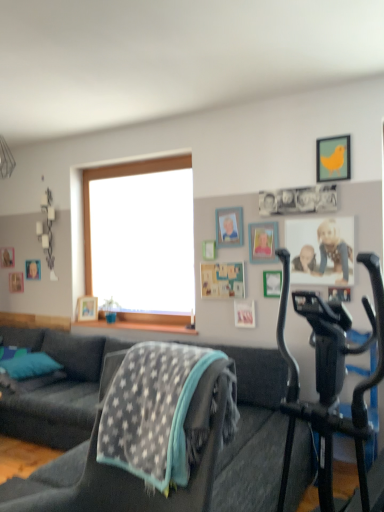
Question: Would you say wooden picture frame at left, positioned as the 8th picture frame in front-to-back order, is to the left or to the right of wooden picture frame at lower left, which ranks as the 3th picture frame in left-to-right order, in the picture?

Choices:
 (A) left
 (B) right

Answer: (A)

Question: In terms of size, does wooden picture frame at left, which appears as the 1th picture frame when viewed from the left, appear bigger or smaller than wooden picture frame at lower left, which appears as the 3th picture frame when viewed from the back?

Choices:
 (A) small
 (B) big

Answer: (A)

Question: Which object is positioned farthest from the yellow matte picture frame at upper right, positioned as the first picture frame in front-to-back order?

Choices:
 (A) dark gray fabric couch at center, which is the second studio couch from left to right
 (B) wooden picture frame at left, positioned as the 8th picture frame in front-to-back order
 (C) wooden picture frame at lower left, which appears as the 3th picture frame when viewed from the back
 (D) black matte stationary bicycle at right
 (E) wooden picture frame at upper center, marked as the sixth picture frame in a back-to-front arrangement

Answer: (B)

Question: Which of these objects is positioned farthest from the wooden picture frame at left, positioned as the 8th picture frame in front-to-back order?

Choices:
 (A) metallic silver picture frame at center, the seventh picture frame from the left
 (B) teal fabric pillow at lower left
 (C) dark gray fabric couch at lower left, the second studio couch from the right
 (D) wooden picture frame at lower left, which ranks as the 3th picture frame in left-to-right order
 (E) wooden photo frame at upper center, the 4th picture frame in the back-to-front sequence

Answer: (A)